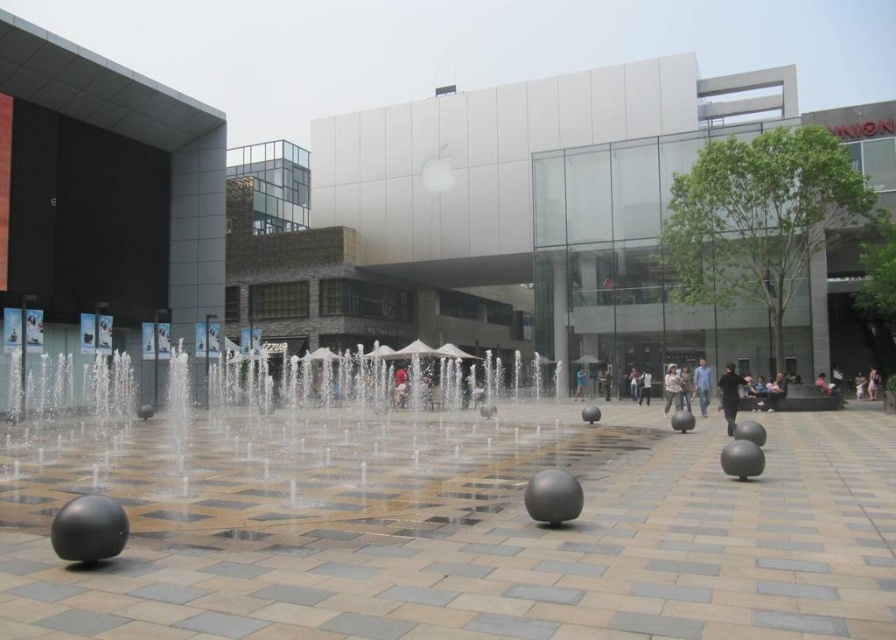
Question: Which of these objects is positioned farthest from the light brown leather jacket at center?

Choices:
 (A) blue denim shirt at center
 (B) matte white building at center
 (C) light brown fabric bag at lower right
 (D) black matte person at center

Answer: (B)

Question: Can you confirm if matte white building at center is positioned above blue denim shirt at center?

Choices:
 (A) yes
 (B) no

Answer: (A)

Question: Considering the real-world distances, which object is closest to the light skin human at center?

Choices:
 (A) light brown leather jacket at center
 (B) light brown fabric bag at lower right
 (C) black matte person at center
 (D) blue denim shirt at center

Answer: (A)

Question: Which point appears farthest from the camera in this image?

Choices:
 (A) (679, 401)
 (B) (707, 401)

Answer: (A)

Question: Is matte white building at center bigger than blue denim shirt at center?

Choices:
 (A) no
 (B) yes

Answer: (B)

Question: From the image, what is the correct spatial relationship of black matte person at center in relation to light skin human at center?

Choices:
 (A) above
 (B) below

Answer: (A)